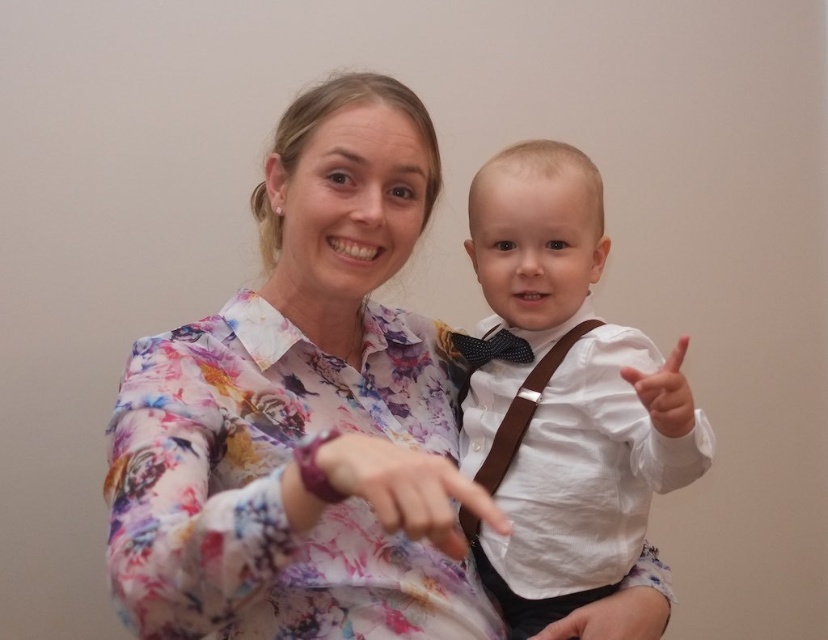
You are a photographer trying to capture the perfect shot of the woman and the child in the image. You notice there is a point at coordinates point (x=407, y=488). What object is located at that point?

The object at point (x=407, y=488) is the matte floral shirt at center.

Consider the image. You are a photographer trying to capture a candid shot of the two subjects. You notice the matte floral shirt at center and the white matte hand at lower center. Which object is located to the left of the other?

The matte floral shirt at center is positioned on the left side of white matte hand at lower center.

You are a photographer trying to decide which clothing item to focus on in the image. The matte floral shirt at center and the brown leather suspenders at center are both in the frame. Which item has a narrower width?

The matte floral shirt at center is thinner than the brown leather suspenders at center, so the matte floral shirt at center has a narrower width.